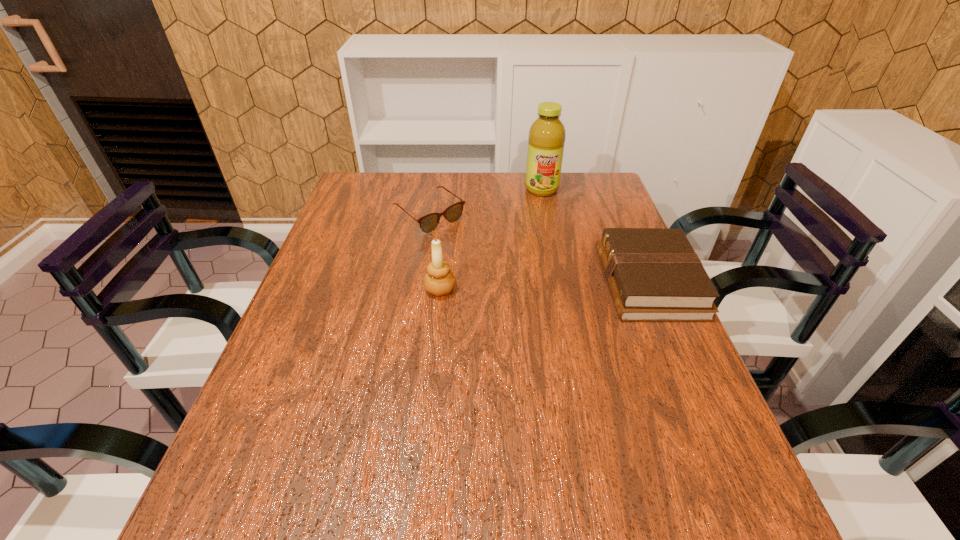
Where is `free point located at the front view of the shortest object`? free point located at the front view of the shortest object is located at coordinates (473, 250).

Find the location of a particular element. vacant point located at the front view of the shortest object is located at coordinates (533, 296).

Where is `free space located 0.140m at the front view of the shortest object`? free space located 0.140m at the front view of the shortest object is located at coordinates coord(480,255).

The width and height of the screenshot is (960, 540). I want to click on vacant area situated 0.120m on the front label of the fruit juice, so click(545, 219).

Identify the location of blank space located on the front label of the fruit juice. (548, 244).

Locate an element on the screen. Image resolution: width=960 pixels, height=540 pixels. vacant space located on the front label of the fruit juice is located at coordinates (547, 234).

Locate an element on the screen. spectacles present at the far edge is located at coordinates (429, 222).

Identify the location of fruit juice at the far edge. (546, 139).

The image size is (960, 540). Identify the location of object located at the right edge. (654, 275).

Where is `vacant space at the far edge`? This screenshot has height=540, width=960. vacant space at the far edge is located at coordinates (417, 195).